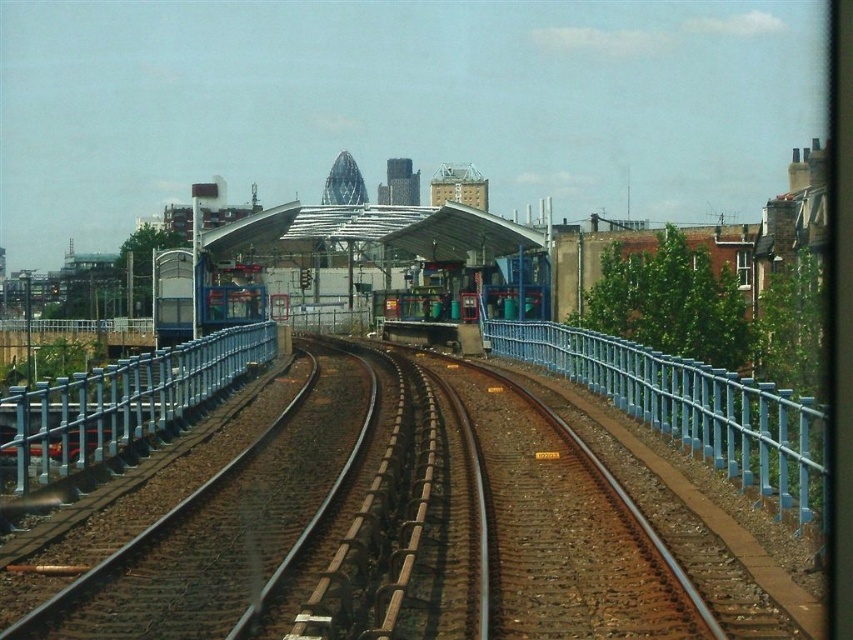
Is metallic blue rail at center shorter than transparent glass railway station at center?

Indeed, metallic blue rail at center has a lesser height compared to transparent glass railway station at center.

Is metallic blue rail at center below transparent glass railway station at center?

Yes, metallic blue rail at center is below transparent glass railway station at center.

Describe the element at coordinates (119, 403) in the screenshot. I see `metallic blue rail at center` at that location.

Identify the location of metallic blue rail at center. (119, 403).

Who is taller, transparent glass railway station at center or metallic blue train at center?

Standing taller between the two is transparent glass railway station at center.

Is transparent glass railway station at center further to the viewer compared to metallic blue train at center?

No.

Looking at this image, who is more distant from viewer, (403, 220) or (233, 298)?

The point (403, 220) is behind.

You are a GUI agent. You are given a task and a screenshot of the screen. Output one action in this format:
    pyautogui.click(x=<x>, y=<y>)
    Task: Click on the transparent glass railway station at center
    The width and height of the screenshot is (853, 640).
    Given the screenshot: What is the action you would take?
    pyautogui.click(x=379, y=228)

Which of these two, blue metallic rail at right or transparent glass railway station at center, stands taller?

Standing taller between the two is transparent glass railway station at center.

Can you confirm if blue metallic rail at right is thinner than transparent glass railway station at center?

Correct, blue metallic rail at right's width is less than transparent glass railway station at center's.

Locate an element on the screen. Image resolution: width=853 pixels, height=640 pixels. blue metallic rail at right is located at coordinates (689, 406).